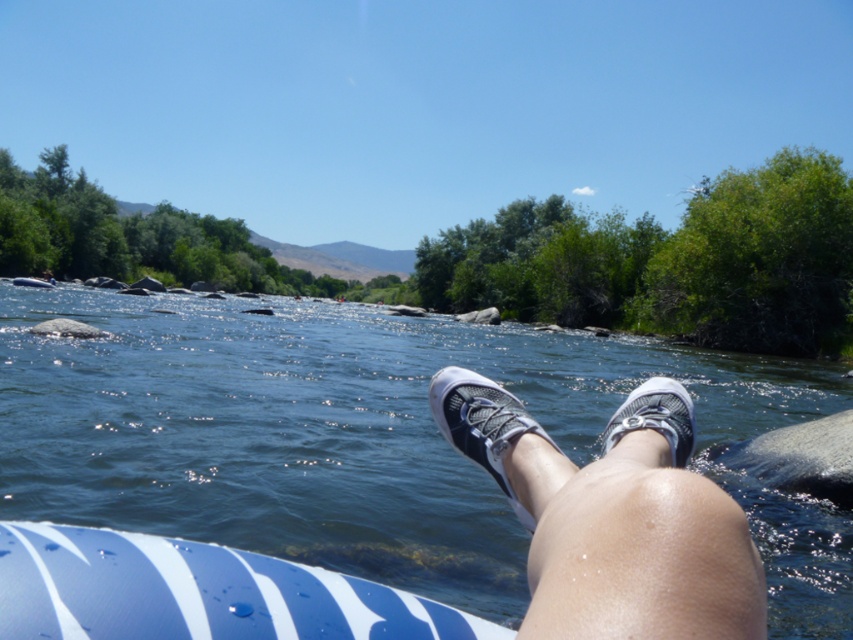
Question: Which point appears farthest from the camera in this image?

Choices:
 (A) (840, 496)
 (B) (668, 381)
 (C) (471, 406)

Answer: (A)

Question: Can you confirm if white mesh sneakers at center is positioned to the right of blue striped board at lower left?

Choices:
 (A) no
 (B) yes

Answer: (B)

Question: From the image, what is the correct spatial relationship of blue rubber raft at lower center in relation to white mesh shoe at center?

Choices:
 (A) above
 (B) below

Answer: (A)

Question: Which object appears closest to the camera in this image?

Choices:
 (A) white mesh shoe at lower center
 (B) blue rubber raft at lower center
 (C) blue striped board at lower left
 (D) white mesh sneakers at center

Answer: (D)

Question: Can you confirm if white mesh sneakers at center is positioned to the left of blue striped board at lower left?

Choices:
 (A) no
 (B) yes

Answer: (A)

Question: Which object is farther from the camera taking this photo?

Choices:
 (A) white mesh shoe at lower center
 (B) white mesh sneakers at center

Answer: (A)